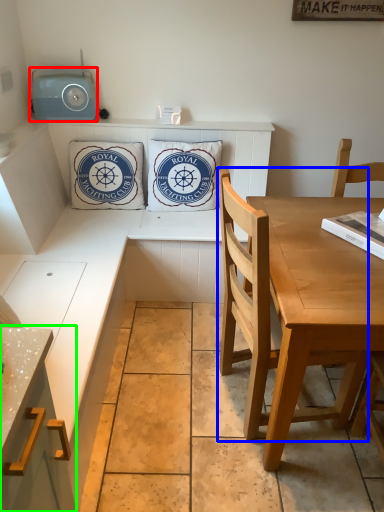
Question: Which is farther away from radio (highlighted by a red box)? chair (highlighted by a blue box) or cabinetry (highlighted by a green box)?

Choices:
 (A) chair
 (B) cabinetry

Answer: (B)